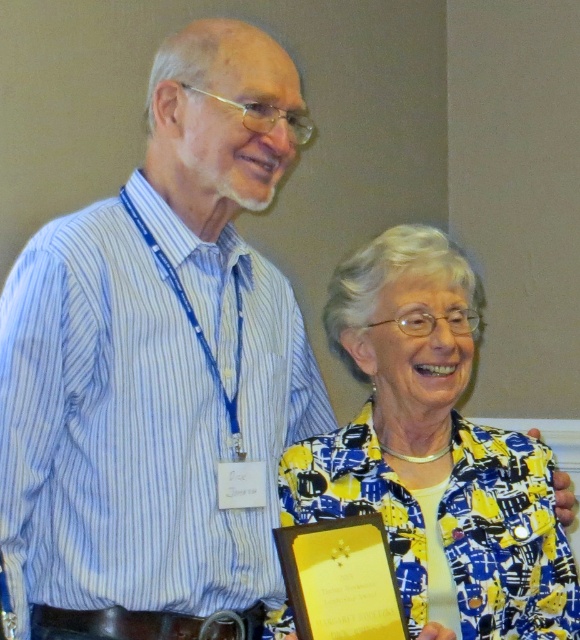
Question: Is blue striped shirt at center smaller than yellow printed fabric at center?

Choices:
 (A) no
 (B) yes

Answer: (A)

Question: Among these objects, which one is nearest to the camera?

Choices:
 (A) yellow printed fabric at center
 (B) gold/yellow paper at lower center
 (C) blue striped shirt at center

Answer: (B)

Question: Does blue striped shirt at center appear on the right side of yellow printed fabric at center?

Choices:
 (A) no
 (B) yes

Answer: (A)

Question: Can you confirm if yellow printed fabric at center is wider than gold/yellow paper at lower center?

Choices:
 (A) no
 (B) yes

Answer: (B)

Question: Among these objects, which one is farthest from the camera?

Choices:
 (A) yellow printed fabric at center
 (B) gold/yellow paper at lower center

Answer: (A)

Question: Which of the following is the farthest from the observer?

Choices:
 (A) blue striped shirt at center
 (B) yellow printed fabric at center
 (C) gold/yellow paper at lower center

Answer: (B)